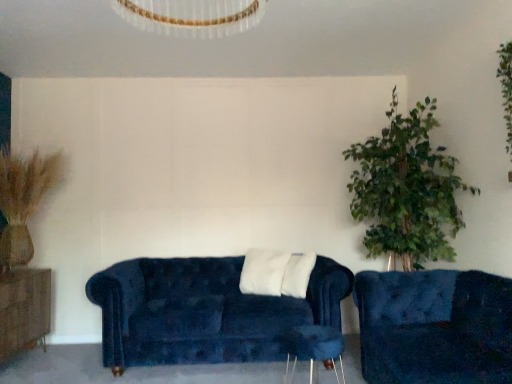
Question: Can you confirm if velvet blue couch at lower right, which appears as the 1th studio couch when viewed from the right, is taller than wooden side table at lower center?

Choices:
 (A) no
 (B) yes

Answer: (B)

Question: Does velvet blue couch at lower right, the second studio couch viewed from the back, appear on the left side of wooden side table at lower center?

Choices:
 (A) no
 (B) yes

Answer: (A)

Question: From the image's perspective, is velvet blue couch at lower right, the 2th studio couch when ordered from left to right, located beneath wooden side table at lower center?

Choices:
 (A) yes
 (B) no

Answer: (B)

Question: Considering the relative positions of velvet blue couch at lower right, which appears as the 1th studio couch when viewed from the right, and wooden side table at lower center in the image provided, is velvet blue couch at lower right, which appears as the 1th studio couch when viewed from the right, behind wooden side table at lower center?

Choices:
 (A) yes
 (B) no

Answer: (B)

Question: Is velvet blue couch at lower right, which appears as the 1th studio couch when viewed from the right, located outside wooden side table at lower center?

Choices:
 (A) yes
 (B) no

Answer: (A)

Question: Looking at their shapes, would you say velvet blue couch at center, which is counted as the 2th studio couch, starting from the front, is wider or thinner than velvet blue couch at lower right, the second studio couch viewed from the back?

Choices:
 (A) wide
 (B) thin

Answer: (B)

Question: Does point click(x=331, y=321) appear closer or farther from the camera than point click(x=424, y=357)?

Choices:
 (A) closer
 (B) farther

Answer: (B)

Question: From a real-world perspective, is velvet blue couch at center, which is counted as the 2th studio couch, starting from the front, physically located above or below velvet blue couch at lower right, the 2th studio couch when ordered from left to right?

Choices:
 (A) above
 (B) below

Answer: (A)

Question: From the image's perspective, relative to velvet blue couch at lower right, which is the 1th studio couch from front to back, is velvet blue couch at center, placed as the first studio couch when sorted from left to right, above or below?

Choices:
 (A) below
 (B) above

Answer: (A)

Question: From the image's perspective, relative to brown wood dresser at left, is wooden side table at lower center above or below?

Choices:
 (A) above
 (B) below

Answer: (B)

Question: Is wooden side table at lower center to the left or to the right of brown wood dresser at left in the image?

Choices:
 (A) left
 (B) right

Answer: (B)

Question: Choose the correct answer: Is wooden side table at lower center inside brown wood dresser at left or outside it?

Choices:
 (A) outside
 (B) inside

Answer: (A)

Question: In the image, is wooden side table at lower center positioned in front of or behind brown wood dresser at left?

Choices:
 (A) behind
 (B) front

Answer: (B)

Question: Considering the relative positions of velvet blue couch at lower right, which is the 1th studio couch from front to back, and velvet blue couch at center, positioned as the second studio couch in right-to-left order, in the image provided, is velvet blue couch at lower right, which is the 1th studio couch from front to back, to the left or to the right of velvet blue couch at center, positioned as the second studio couch in right-to-left order,?

Choices:
 (A) left
 (B) right

Answer: (B)

Question: From a real-world perspective, is velvet blue couch at lower right, which appears as the 1th studio couch when viewed from the right, positioned above or below velvet blue couch at center, placed as the first studio couch when sorted from left to right?

Choices:
 (A) above
 (B) below

Answer: (B)